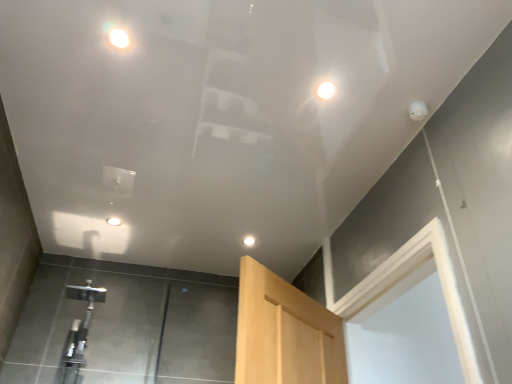
Question: In terms of width, does white glossy droplight at upper center, the fourth droplight viewed from the left, look wider or thinner when compared to white glossy droplight at upper center, which appears as the 2th droplight when viewed from the back?

Choices:
 (A) thin
 (B) wide

Answer: (A)

Question: Is point (328, 91) closer or farther from the camera than point (111, 223)?

Choices:
 (A) farther
 (B) closer

Answer: (B)

Question: Considering the real-world distances, which object is closest to the white glossy droplight at upper center, which ranks as the third droplight in top-to-bottom order?

Choices:
 (A) satin nickel faucet at lower left
 (B) white glossy droplight at upper center, the fourth droplight viewed from the left
 (C) matte white droplight at upper center, acting as the second droplight starting from the left
 (D) white glossy droplight at upper center, arranged as the fourth droplight when viewed from the top

Answer: (A)

Question: Estimate the real-world distances between objects in this image. Which object is closer to the white glossy droplight at upper center, which ranks as the third droplight in top-to-bottom order?

Choices:
 (A) satin nickel faucet at lower left
 (B) white glossy droplight at upper center, arranged as the fourth droplight when viewed from the top
 (C) matte white droplight at upper center, the 1th droplight in the top-to-bottom sequence
 (D) white glossy droplight at upper center, acting as the 2th droplight starting from the top

Answer: (A)